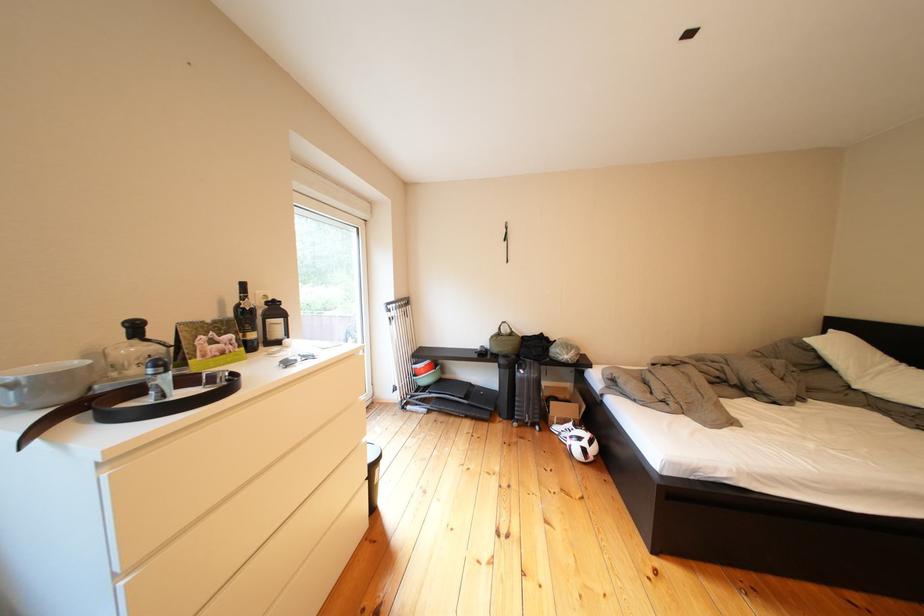
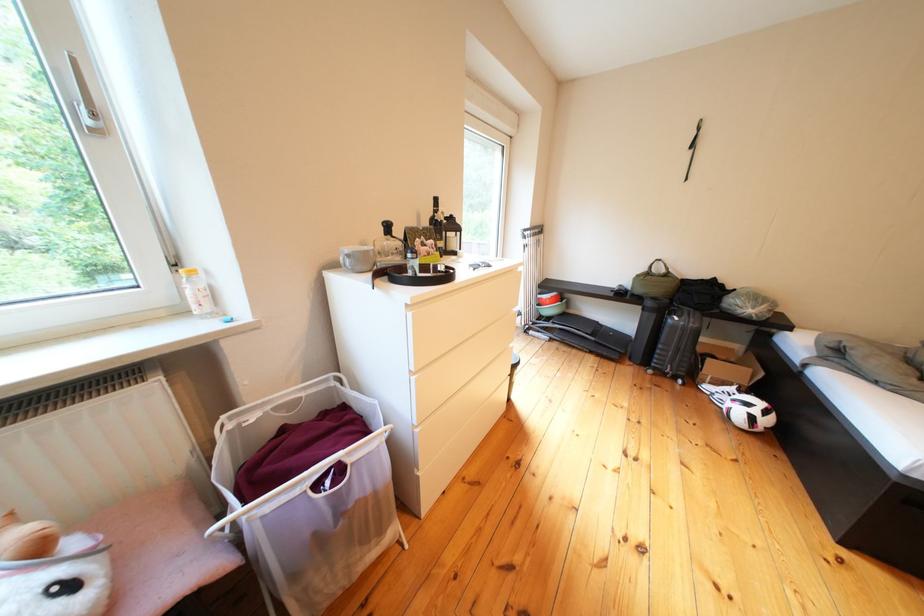
Based on the continuous images, in which direction is the camera rotating?

The camera's rotation is toward left-down.